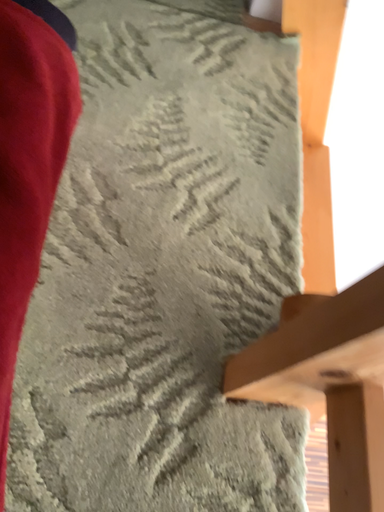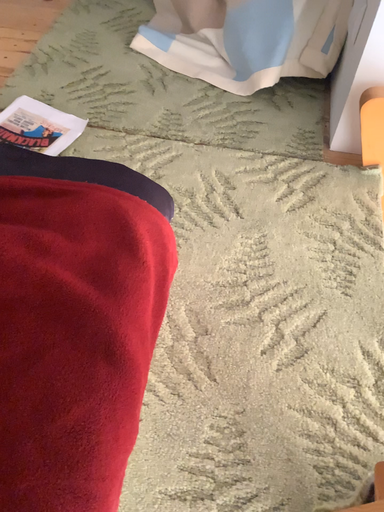
Question: Which way did the camera rotate in the video?

Choices:
 (A) rotated right
 (B) rotated left

Answer: (B)